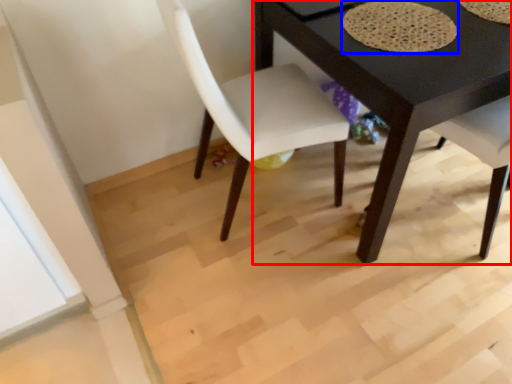
Question: Which point is further to the camera, table (highlighted by a red box) or mat (highlighted by a blue box)?

Choices:
 (A) table
 (B) mat

Answer: (B)